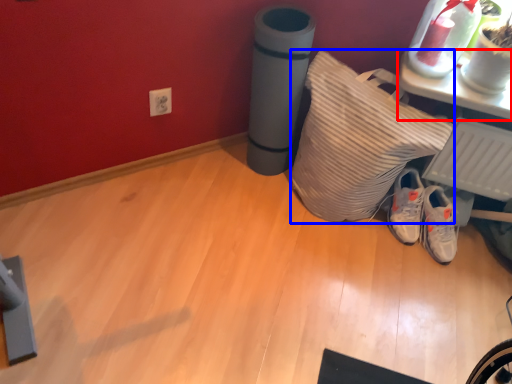
Question: Which object is further to the camera taking this photo, furniture (highlighted by a red box) or pillow (highlighted by a blue box)?

Choices:
 (A) furniture
 (B) pillow

Answer: (A)